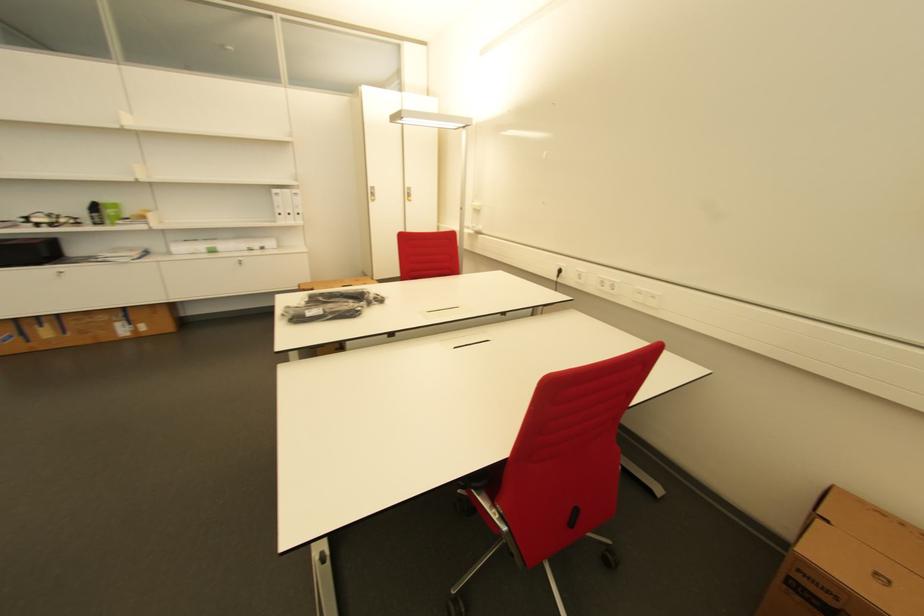
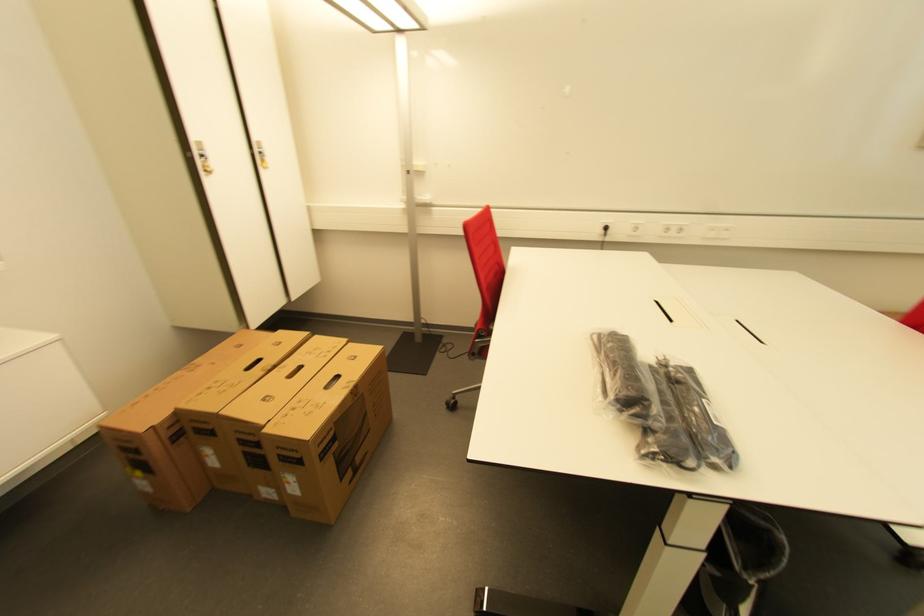
The point at (565, 273) is marked in the first image. Where is the corresponding point in the second image?

(611, 230)